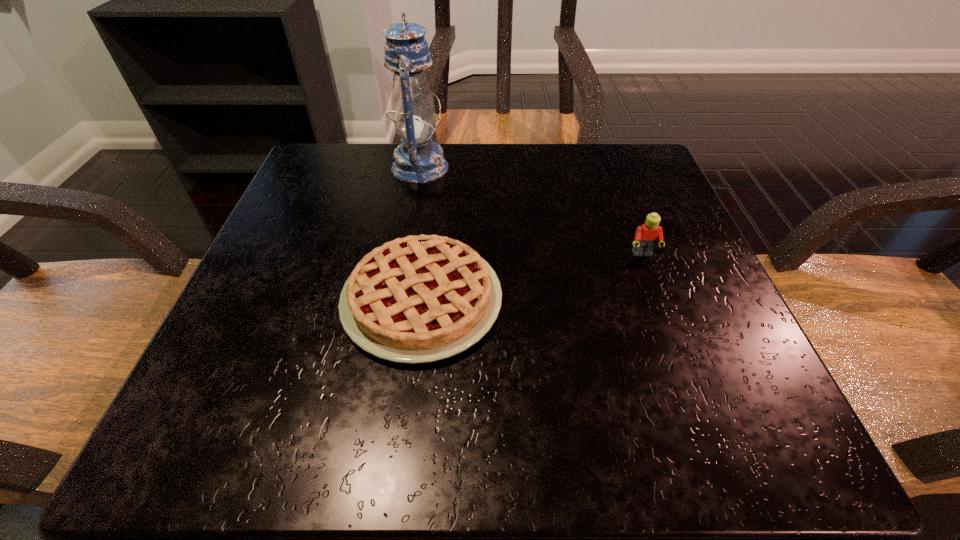
Find the location of a particular element. Image resolution: width=960 pixels, height=540 pixels. free point between the Lego and the shortest object is located at coordinates (532, 277).

I want to click on free point between the pie and the tallest object, so click(x=421, y=234).

Image resolution: width=960 pixels, height=540 pixels. Find the location of `unoccupied area between the rightmost object and the tallest object`. unoccupied area between the rightmost object and the tallest object is located at coordinates (531, 211).

Identify the location of empty space that is in between the lantern and the rightmost object. (531, 211).

Where is `free area in between the shortest object and the tallest object`? free area in between the shortest object and the tallest object is located at coordinates (421, 234).

Locate an element on the screen. The height and width of the screenshot is (540, 960). free space between the lantern and the second tallest object is located at coordinates (531, 211).

This screenshot has height=540, width=960. I want to click on vacant area that lies between the shortest object and the lantern, so click(x=421, y=234).

Identify the location of vacant space in between the rightmost object and the tallest object. (531, 211).

Point out which object is positioned as the nearest to the tallest object. Please provide its 2D coordinates. Your answer should be formatted as a tuple, i.e. [(x, y)], where the tuple contains the x and y coordinates of a point satisfying the conditions above.

[(422, 298)]

Locate an element on the screen. The width and height of the screenshot is (960, 540). object that ranks as the closest to the shortest object is located at coordinates (418, 159).